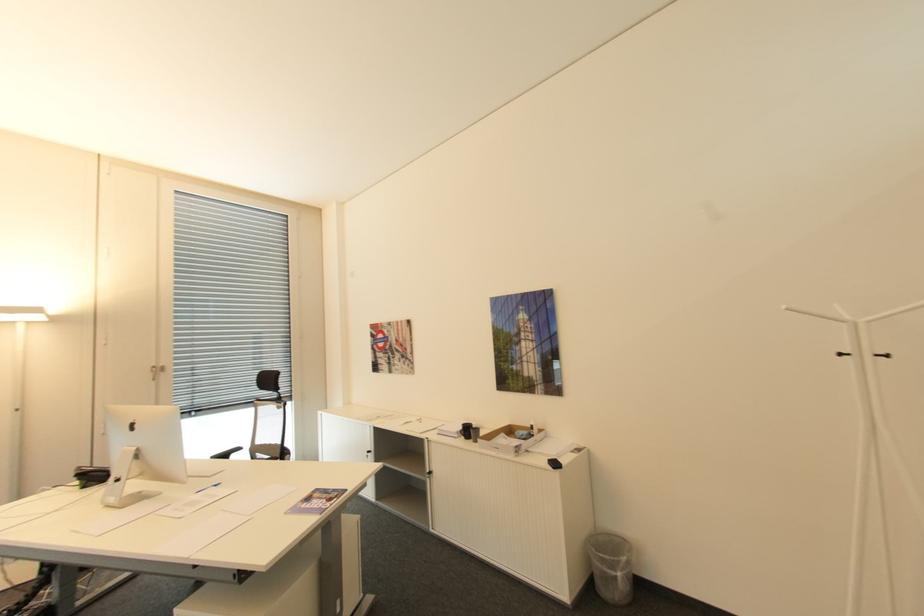
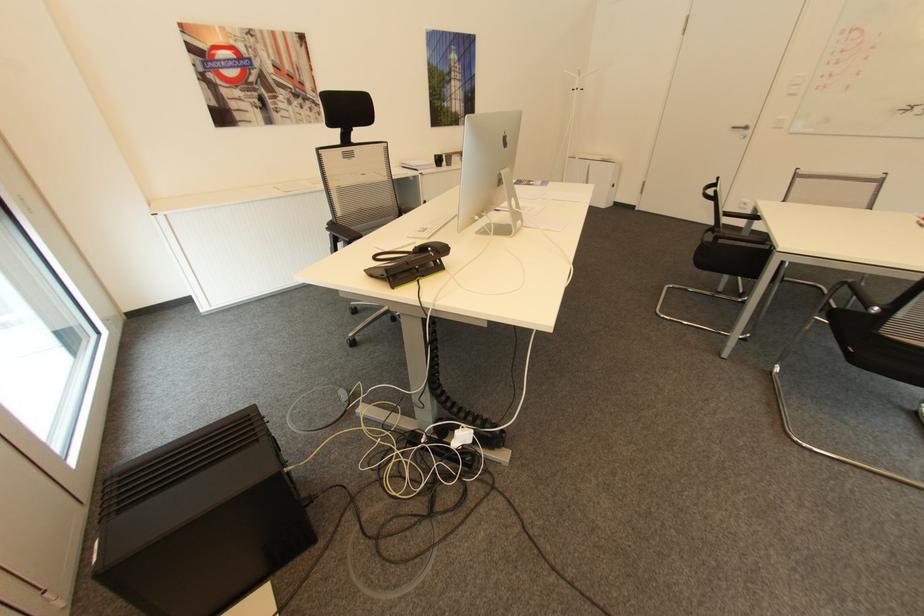
Locate, in the second image, the point that corresponds to (x=417, y=360) in the first image.

(322, 102)